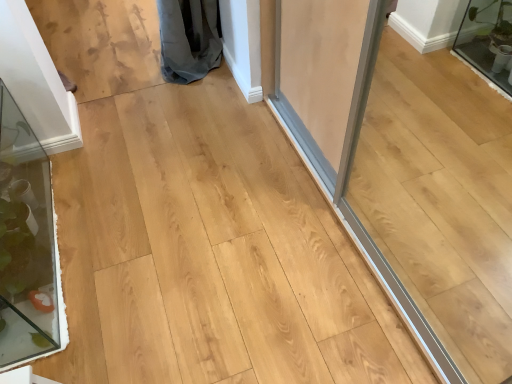
The image size is (512, 384). What do you see at coordinates (27, 245) in the screenshot?
I see `transparent glass at left` at bounding box center [27, 245].

Where is `transparent glass at left`? The height and width of the screenshot is (384, 512). transparent glass at left is located at coordinates (27, 245).

Find the location of `transparent glass at left`. transparent glass at left is located at coordinates (27, 245).